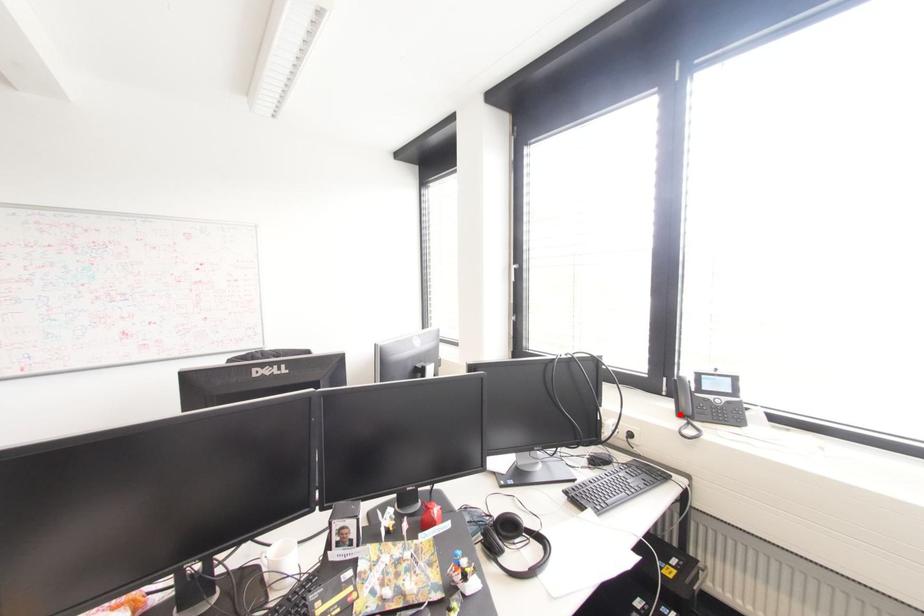
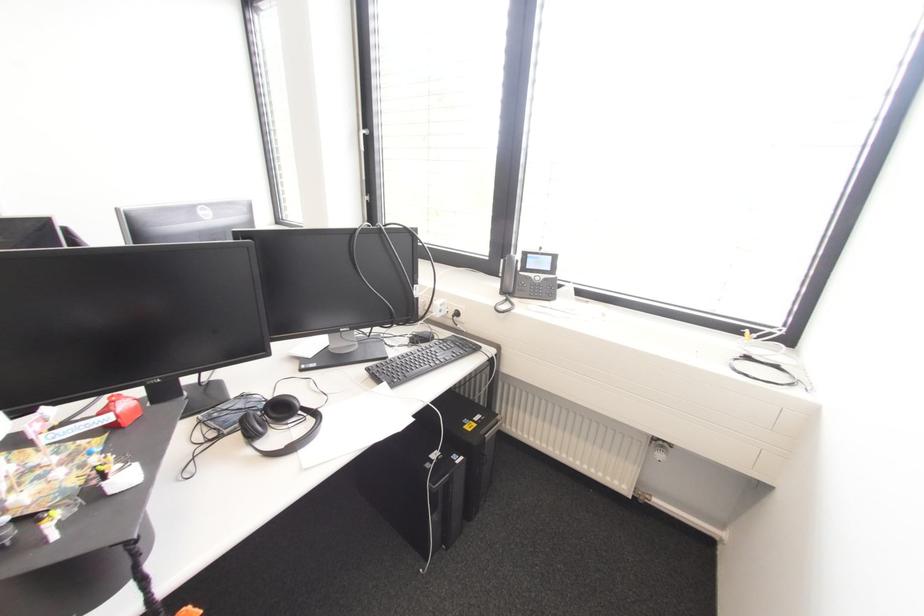
In the second image, find the point that corresponds to the highlighted location in the first image.

(503, 292)